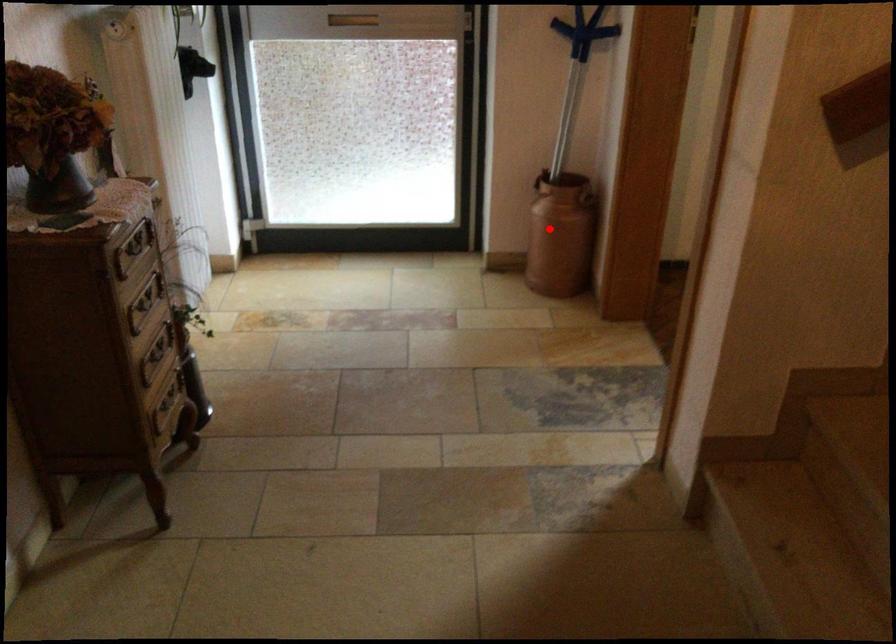
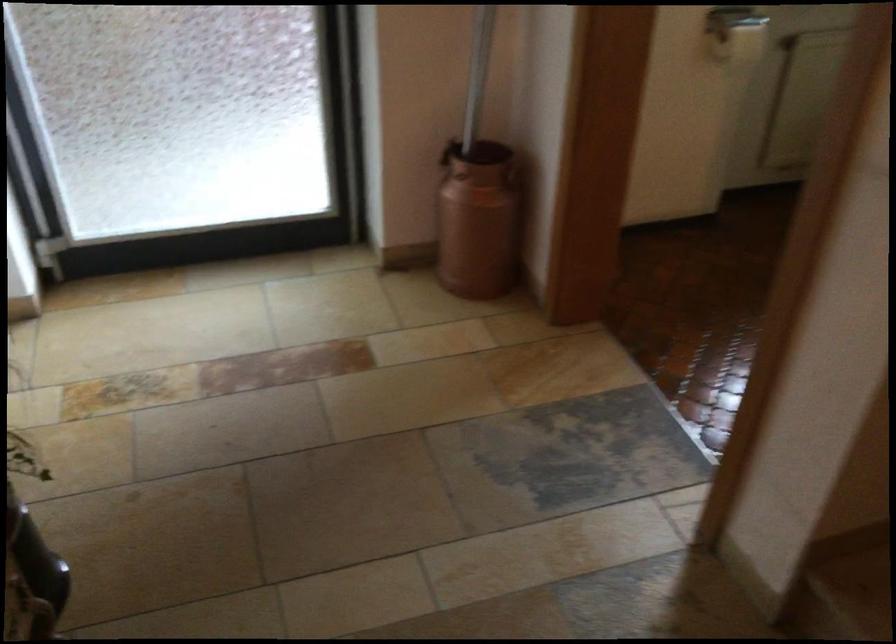
Locate, in the second image, the point that corresponds to the highlighted location in the first image.

(478, 220)